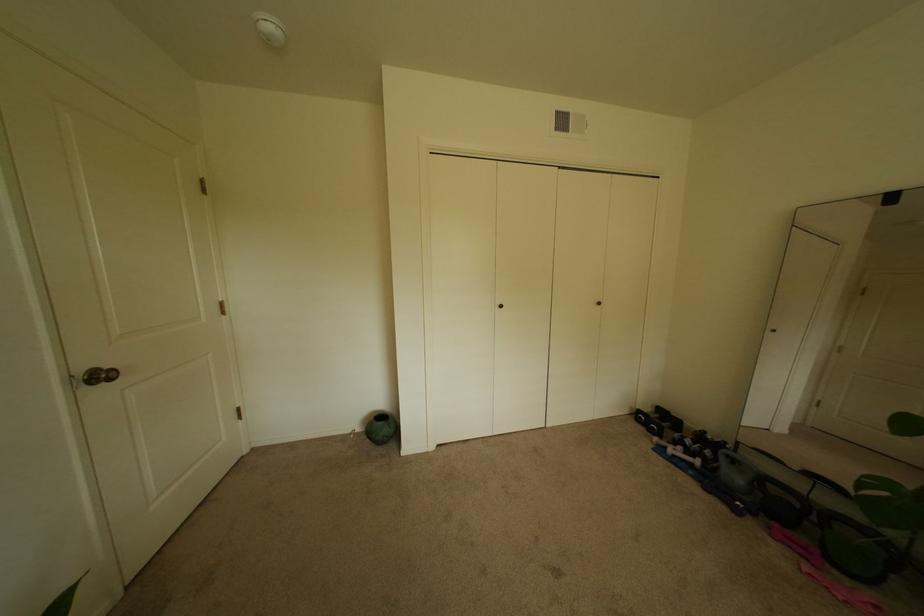
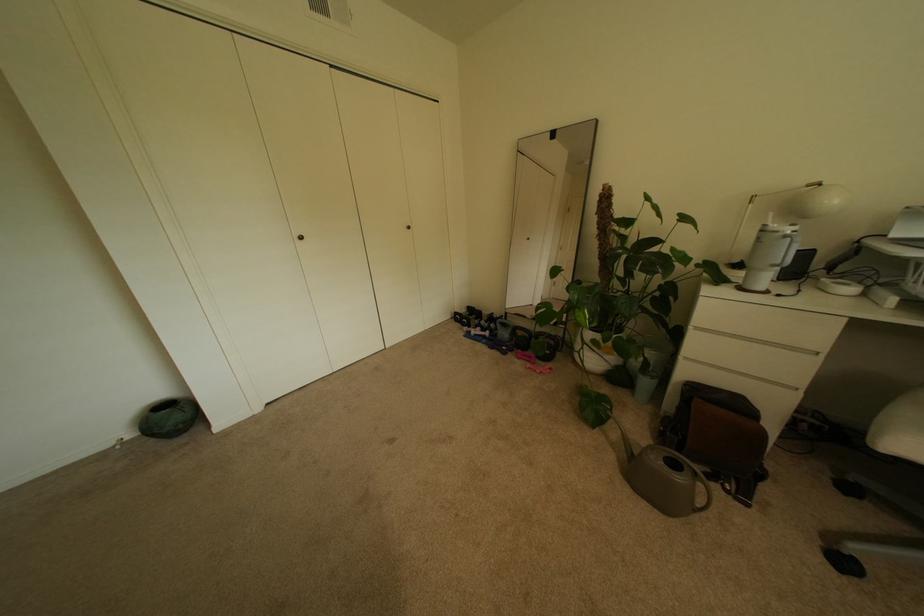
In the second image, find the point that corresponds to [771,516] in the first image.

(524, 350)